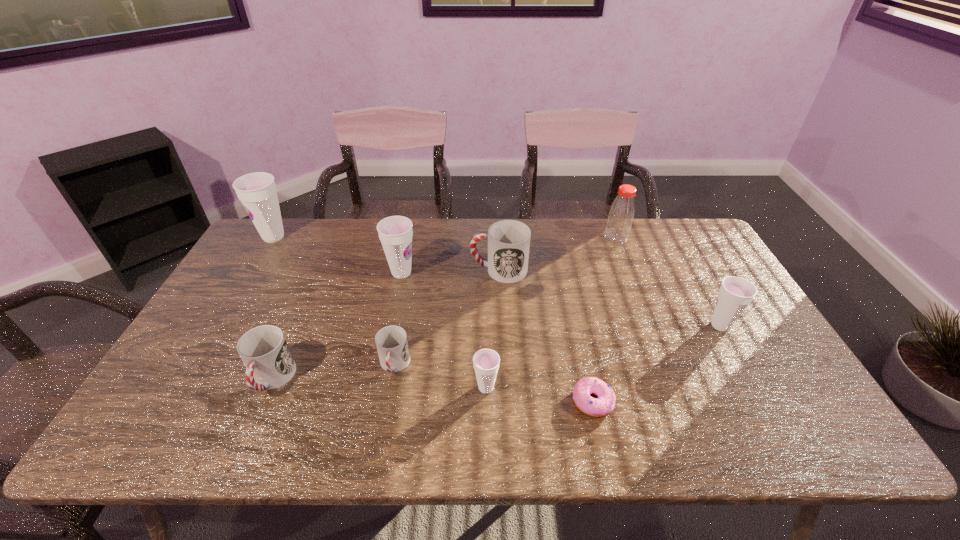
Locate an element on the screen. the farthest purple cup is located at coordinates (257, 191).

At what (x,y) coordinates should I click in order to perform the action: click on the biggest purple cup. Please return your answer as a coordinate pair (x, y). The width and height of the screenshot is (960, 540). Looking at the image, I should click on (257, 191).

The height and width of the screenshot is (540, 960). I want to click on the eighth object from left to right, so click(x=622, y=210).

Identify the location of bottle. Image resolution: width=960 pixels, height=540 pixels. (622, 210).

I want to click on the second biggest purple cup, so click(x=395, y=232).

At what (x,y) coordinates should I click in order to perform the action: click on the second purple cup from left to right. Please return your answer as a coordinate pair (x, y). The height and width of the screenshot is (540, 960). Looking at the image, I should click on (395, 232).

Identify the location of the rightmost red cup. The height and width of the screenshot is (540, 960). (508, 240).

Locate an element on the screen. The image size is (960, 540). the farthest red cup is located at coordinates [x=508, y=240].

At what (x,y) coordinates should I click in order to perform the action: click on the fourth nearest cup. Please return your answer as a coordinate pair (x, y). Image resolution: width=960 pixels, height=540 pixels. Looking at the image, I should click on (735, 294).

The height and width of the screenshot is (540, 960). I want to click on the second smallest purple cup, so click(735, 294).